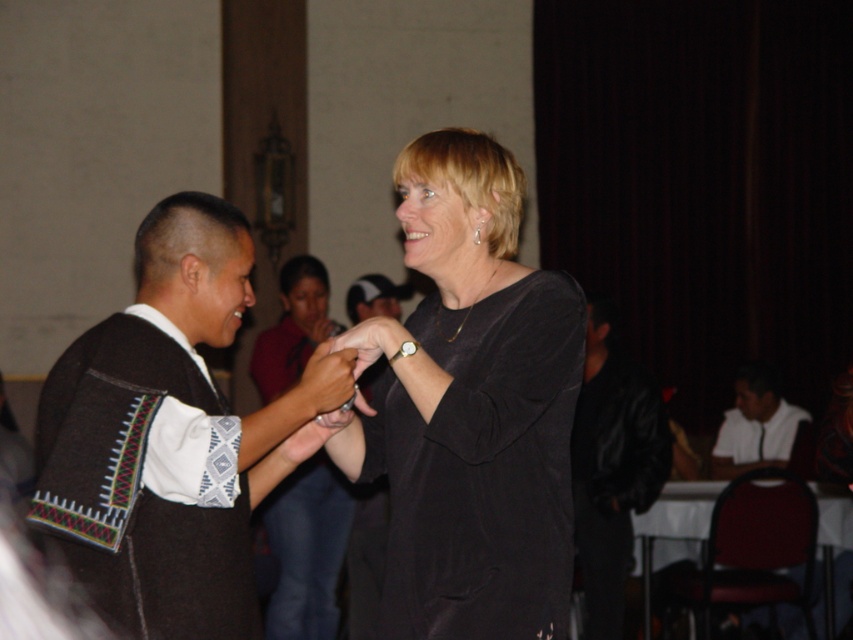
Who is lower down, matte black dress at center or matte black hand at center?

Positioned lower is matte black dress at center.

In the scene shown: Is matte black dress at center thinner than matte black hand at center?

No, matte black dress at center is not thinner than matte black hand at center.

Locate an element on the screen. This screenshot has width=853, height=640. matte black dress at center is located at coordinates (306, 548).

Where is `matte black dress at center`? The image size is (853, 640). matte black dress at center is located at coordinates (306, 548).

Based on the photo, is knitted wool sweater at left below white glossy shirt at lower right?

Incorrect, knitted wool sweater at left is not positioned below white glossy shirt at lower right.

Does knitted wool sweater at left have a greater width compared to white glossy shirt at lower right?

Yes.

The height and width of the screenshot is (640, 853). What are the coordinates of `knitted wool sweater at left` in the screenshot? It's located at (161, 438).

Is knitted wool sweater at left in front of black leather jacket at right?

Yes, it is.

Does knitted wool sweater at left come behind black leather jacket at right?

That is False.

Identify the location of knitted wool sweater at left. This screenshot has width=853, height=640. (161, 438).

The image size is (853, 640). I want to click on knitted wool sweater at left, so (x=161, y=438).